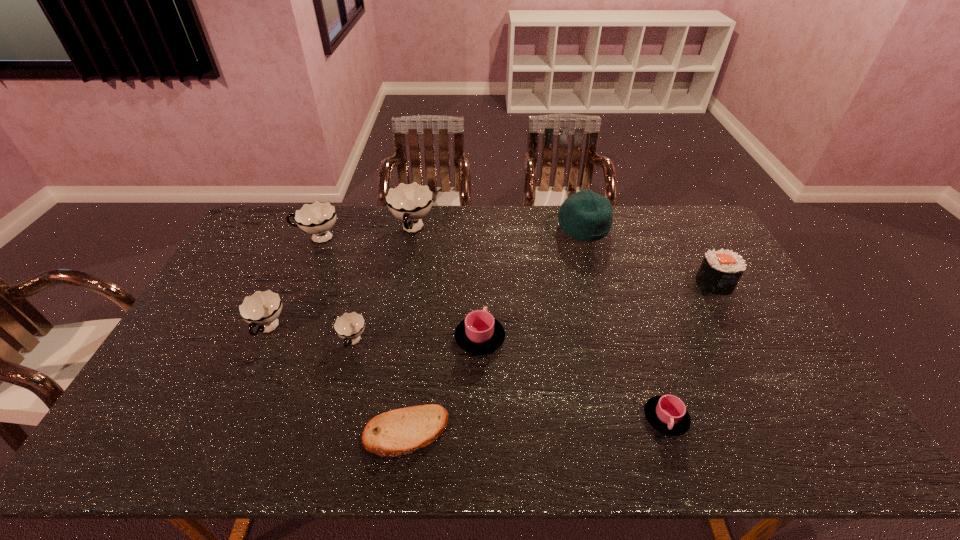
I want to click on beanie, so click(586, 216).

Image resolution: width=960 pixels, height=540 pixels. Find the location of `the biggest white cup`. the biggest white cup is located at coordinates (410, 202).

At what (x,y) coordinates should I click in order to perform the action: click on the second biggest white cup. Please return your answer as a coordinate pair (x, y). The height and width of the screenshot is (540, 960). Looking at the image, I should click on (317, 218).

Identify the location of the sixth nearest object. (720, 271).

In order to click on sushi in this screenshot , I will do `click(720, 271)`.

At what (x,y) coordinates should I click in order to perform the action: click on the fourth shortest cup. Please return your answer as a coordinate pair (x, y). Looking at the image, I should click on (262, 308).

The width and height of the screenshot is (960, 540). I want to click on the smallest white cup, so click(x=349, y=326).

You are a GUI agent. You are given a task and a screenshot of the screen. Output one action in this format:
    pyautogui.click(x=<x>, y=<y>)
    Task: Click on the sixth object from left to right
    
    Given the screenshot: What is the action you would take?
    pyautogui.click(x=479, y=333)

This screenshot has height=540, width=960. Identify the location of the farther pink cup. (479, 333).

Find the location of `the rightmost cup`. the rightmost cup is located at coordinates (667, 414).